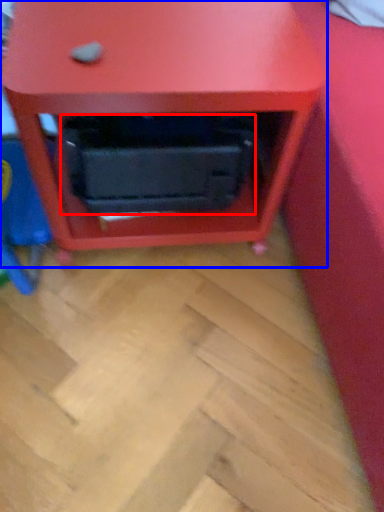
Question: Which object appears closest to the camera in this image, drawer (highlighted by a red box) or furniture (highlighted by a blue box)?

Choices:
 (A) drawer
 (B) furniture

Answer: (B)